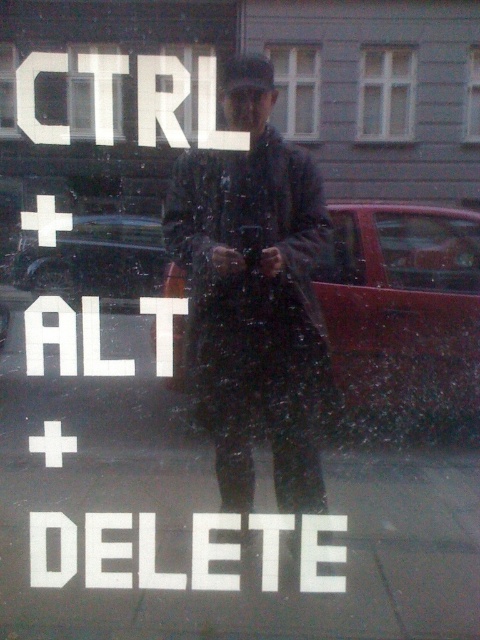
You are trying to clean the window and need to know which layer of glass you should clean first. Based on the scene, which glass is closer to you, the clear glass window at upper center or the transparent glass window at upper center?

The clear glass window at upper center is closer to you because the transparent glass window at upper center is behind it.

You are a window cleaner and need to clean the point at coordinates (x=385, y=93) on the white plastic window at upper center. Can you confirm the exact location of this point?

The point at coordinates (x=385, y=93) is located on the white plastic window at upper center.